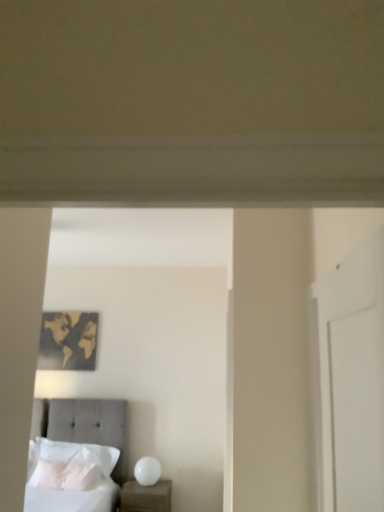
Question: From the image's perspective, is tufted fabric bed at lower left located beneath gold metallic world map at upper left?

Choices:
 (A) yes
 (B) no

Answer: (A)

Question: Is tufted fabric bed at lower left looking in the opposite direction of gold metallic world map at upper left?

Choices:
 (A) no
 (B) yes

Answer: (A)

Question: Does tufted fabric bed at lower left have a greater width compared to gold metallic world map at upper left?

Choices:
 (A) no
 (B) yes

Answer: (B)

Question: Is tufted fabric bed at lower left at the left side of gold metallic world map at upper left?

Choices:
 (A) yes
 (B) no

Answer: (B)

Question: Is gold metallic world map at upper left inside tufted fabric bed at lower left?

Choices:
 (A) yes
 (B) no

Answer: (B)

Question: Is gold metallic world map at upper left bigger or smaller than white glossy nightstand at lower center?

Choices:
 (A) big
 (B) small

Answer: (B)

Question: Considering the relative positions of gold metallic world map at upper left and white glossy nightstand at lower center in the image provided, is gold metallic world map at upper left to the left or to the right of white glossy nightstand at lower center?

Choices:
 (A) left
 (B) right

Answer: (A)

Question: From the image's perspective, is gold metallic world map at upper left positioned above or below white glossy nightstand at lower center?

Choices:
 (A) below
 (B) above

Answer: (B)

Question: Do you think gold metallic world map at upper left is within white glossy nightstand at lower center, or outside of it?

Choices:
 (A) outside
 (B) inside

Answer: (A)

Question: Considering the relative positions of white glossy nightstand at lower center and gold metallic world map at upper left in the image provided, is white glossy nightstand at lower center to the left or to the right of gold metallic world map at upper left?

Choices:
 (A) left
 (B) right

Answer: (B)

Question: Which is correct: white glossy nightstand at lower center is inside gold metallic world map at upper left, or outside of it?

Choices:
 (A) inside
 (B) outside

Answer: (B)

Question: Is point (135, 500) positioned closer to the camera than point (66, 334)?

Choices:
 (A) closer
 (B) farther

Answer: (A)

Question: Considering the positions of white glossy nightstand at lower center and gold metallic world map at upper left in the image, is white glossy nightstand at lower center wider or thinner than gold metallic world map at upper left?

Choices:
 (A) thin
 (B) wide

Answer: (B)

Question: From the image's perspective, is white glossy nightstand at lower center located above or below white soft pillow at lower left, which is the 2th pillow in back-to-front order?

Choices:
 (A) below
 (B) above

Answer: (A)

Question: Is white glossy nightstand at lower center taller or shorter than white soft pillow at lower left, which is the 2th pillow in back-to-front order?

Choices:
 (A) tall
 (B) short

Answer: (A)